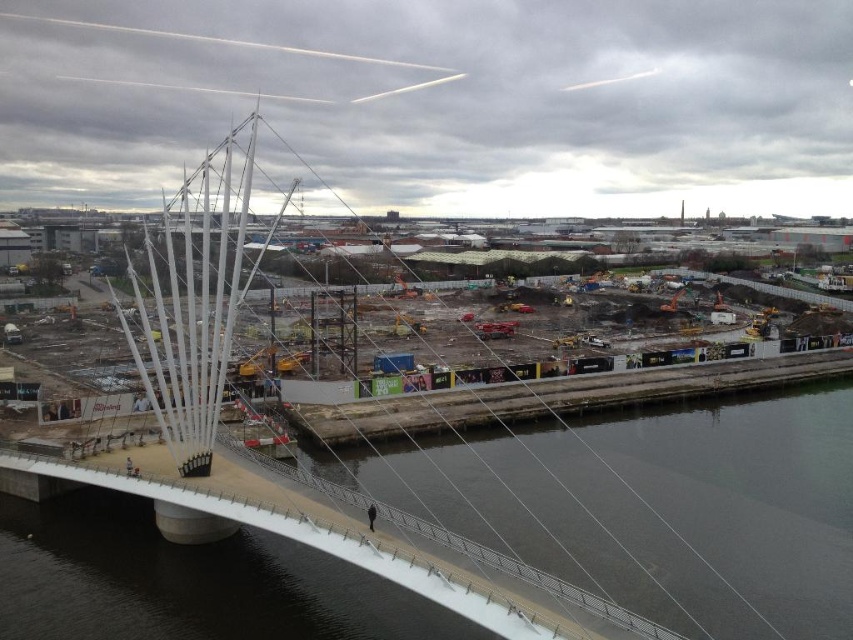
Is point (111, 636) positioned in front of point (746, 611)?

Yes, point (111, 636) is closer to viewer.

Is point (654, 554) positioned behind point (457, 506)?

No, it is not.

Who is more forward, (x=737, y=582) or (x=654, y=499)?

Positioned in front is point (x=737, y=582).

At what (x,y) coordinates should I click in order to perform the action: click on concrete construction site at center. Please return your answer as a coordinate pair (x, y). This screenshot has width=853, height=640. Looking at the image, I should click on (656, 508).